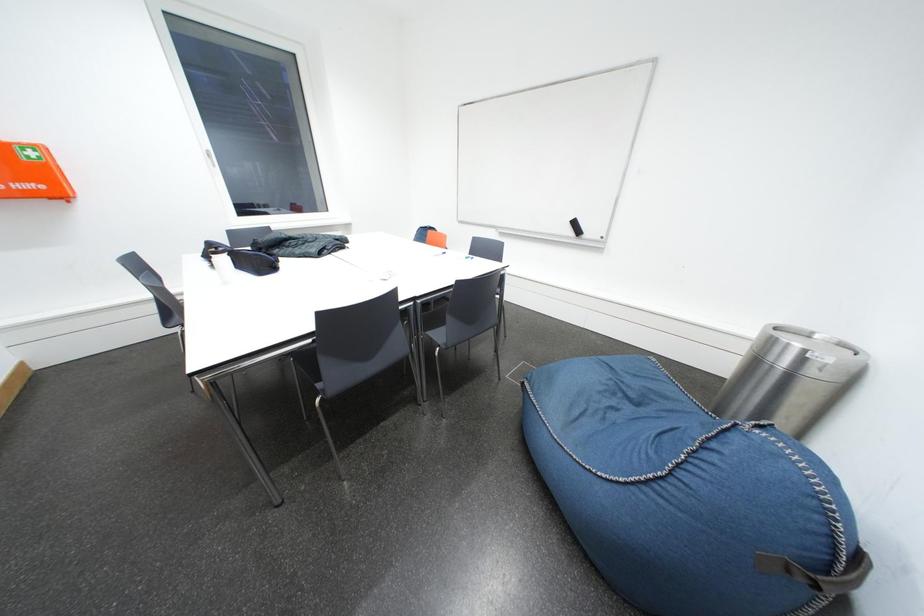
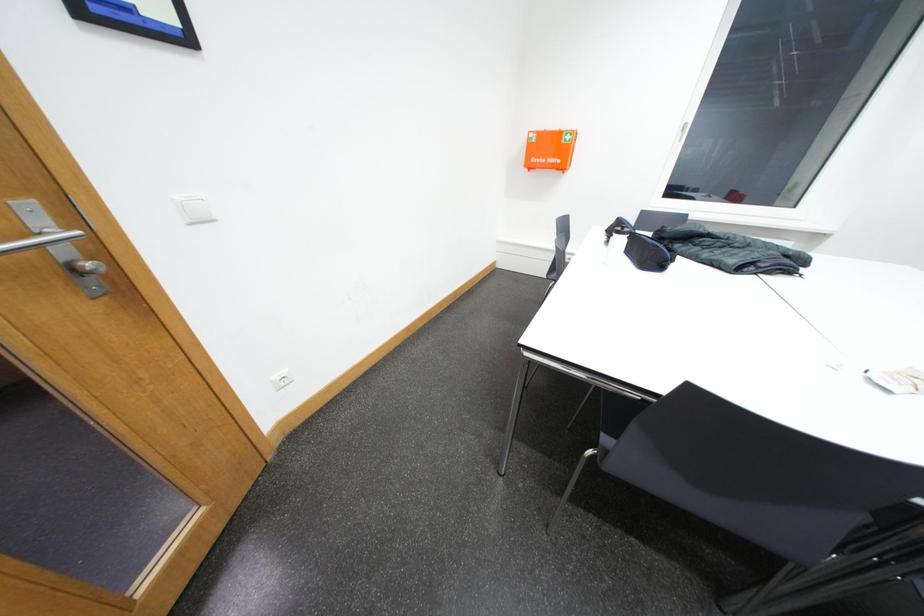
Based on the continuous images, in which direction is the camera rotating?

The camera rotated toward left-down.